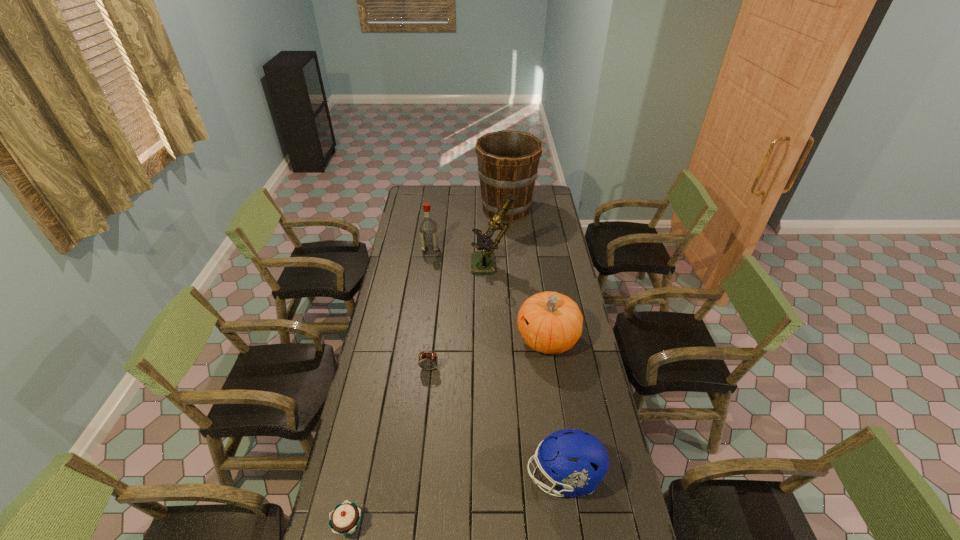
At what (x,y) coordinates should I click in order to perform the action: click on vacant space situated 0.240m at the eyepiece of the microscope. Please return your answer as a coordinate pair (x, y). Looking at the image, I should click on (424, 267).

Where is `vacant region located on the front-facing side of the liquor`? vacant region located on the front-facing side of the liquor is located at coordinates (470, 250).

In order to click on blank space located on the front-facing side of the pumpkin in this screenshot , I will do `click(425, 339)`.

Where is `vacant space located 0.380m on the front-facing side of the pumpkin`? vacant space located 0.380m on the front-facing side of the pumpkin is located at coordinates (427, 339).

The height and width of the screenshot is (540, 960). Find the location of `free location located 0.370m on the front-facing side of the pumpkin`. free location located 0.370m on the front-facing side of the pumpkin is located at coordinates (430, 339).

I want to click on vacant area situated on the face guard of the football helmet, so click(444, 477).

The width and height of the screenshot is (960, 540). Identify the location of free space located on the face guard of the football helmet. (498, 477).

Locate an element on the screen. Image resolution: width=960 pixels, height=540 pixels. blank space located on the face guard of the football helmet is located at coordinates (487, 477).

In order to click on free spot located on the face of the fifth farthest object in this screenshot , I will do `click(425, 400)`.

In order to click on object located at the far edge in this screenshot , I will do `click(508, 161)`.